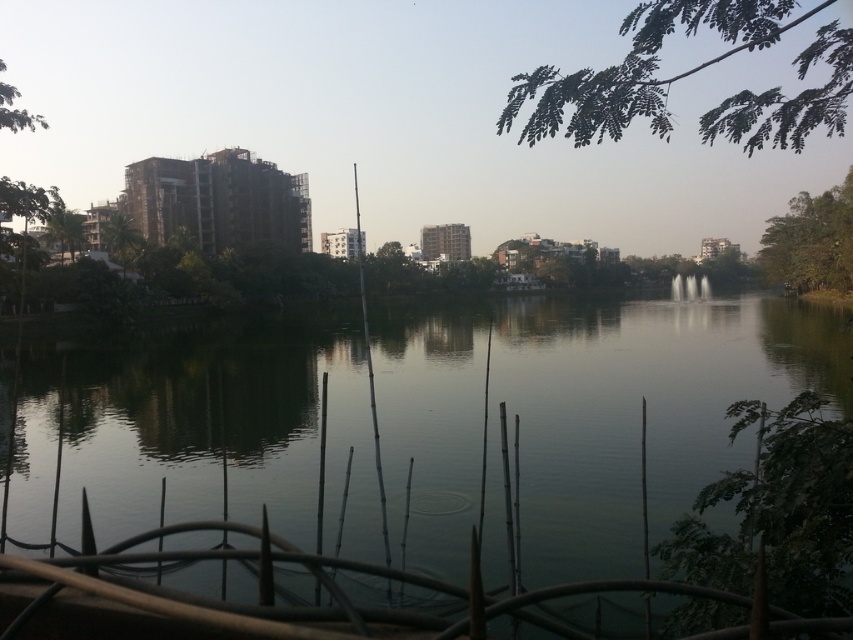
Does green reflective water at center come in front of green leafy branch at upper right?

Yes, it is.

Does green reflective water at center come behind green leafy branch at upper right?

No, green reflective water at center is in front of green leafy branch at upper right.

At what (x,y) coordinates should I click in order to perform the action: click on green reflective water at center. Please return your answer as a coordinate pair (x, y). This screenshot has height=640, width=853. Looking at the image, I should click on pos(583,417).

Based on the photo, measure the distance between point [838,51] and camera.

They are 5.20 meters apart.

Does green leafy branch at upper right have a greater width compared to green leafy tree at left?

A: Yes, green leafy branch at upper right is wider than green leafy tree at left.

Find the location of a particular element. green leafy branch at upper right is located at coordinates (640, 68).

Is point (73, 236) positioned behind point (1, 96)?

That is True.

The height and width of the screenshot is (640, 853). What are the coordinates of `green leafy tree at left` in the screenshot? It's located at (65, 230).